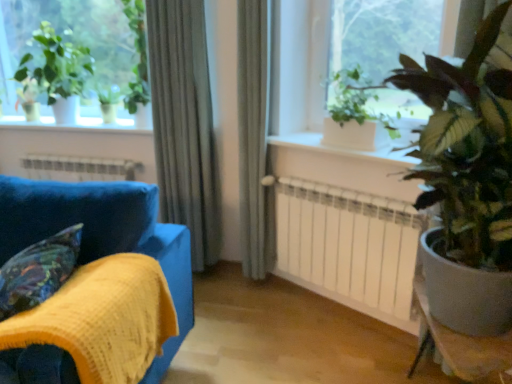
Question: Should I look upward or downward to see white smooth window sill at center?

Choices:
 (A) down
 (B) up

Answer: (B)

Question: Is the depth of velvet-like multicolored pillow at lower left greater than that of white smooth window sill at center?

Choices:
 (A) yes
 (B) no

Answer: (B)

Question: Are velvet-like multicolored pillow at lower left and white smooth window sill at center making contact?

Choices:
 (A) yes
 (B) no

Answer: (B)

Question: From a real-world perspective, is velvet-like multicolored pillow at lower left located higher than white smooth window sill at center?

Choices:
 (A) no
 (B) yes

Answer: (A)

Question: Can you confirm if velvet-like multicolored pillow at lower left is wider than white smooth window sill at center?

Choices:
 (A) no
 (B) yes

Answer: (A)

Question: From a real-world perspective, is velvet-like multicolored pillow at lower left under white smooth window sill at center?

Choices:
 (A) no
 (B) yes

Answer: (B)

Question: Is velvet-like multicolored pillow at lower left positioned beyond the bounds of white smooth window sill at center?

Choices:
 (A) yes
 (B) no

Answer: (A)

Question: Can you confirm if silky gray curtain at center, which is counted as the second curtain, starting from the right, is smaller than smooth gray table at lower right?

Choices:
 (A) no
 (B) yes

Answer: (B)

Question: Is silky gray curtain at center, placed as the 1th curtain when sorted from left to right, outside smooth gray table at lower right?

Choices:
 (A) no
 (B) yes

Answer: (B)

Question: Is silky gray curtain at center, which is counted as the second curtain, starting from the right, looking in the opposite direction of smooth gray table at lower right?

Choices:
 (A) no
 (B) yes

Answer: (A)

Question: From the image's perspective, is silky gray curtain at center, which is counted as the second curtain, starting from the right, on top of smooth gray table at lower right?

Choices:
 (A) no
 (B) yes

Answer: (B)

Question: Could you tell me if silky gray curtain at center, placed as the 1th curtain when sorted from left to right, is facing smooth gray table at lower right?

Choices:
 (A) yes
 (B) no

Answer: (B)

Question: Is silky gray curtain at center, placed as the 1th curtain when sorted from left to right, wider than smooth gray table at lower right?

Choices:
 (A) no
 (B) yes

Answer: (A)

Question: Can we say green leafy plant at upper right lies outside green glossy plant at right, which ranks as the 1th houseplant in right-to-left order?

Choices:
 (A) yes
 (B) no

Answer: (A)